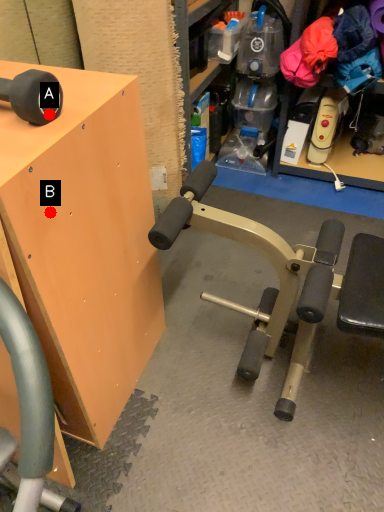
Question: Two points are circled on the image, labeled by A and B beside each circle. Which point is further to the camera?

Choices:
 (A) A is further
 (B) B is further

Answer: (B)